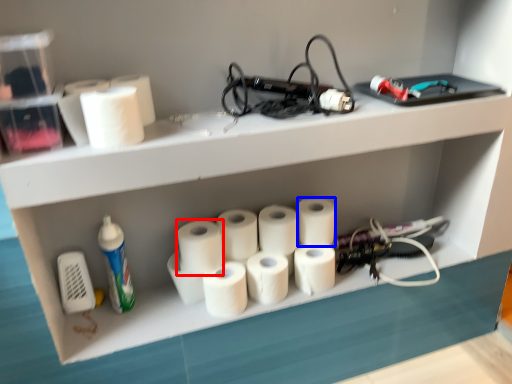
Question: Which object appears farthest to the camera in this image, paper towel (highlighted by a red box) or paper towel (highlighted by a blue box)?

Choices:
 (A) paper towel
 (B) paper towel

Answer: (B)